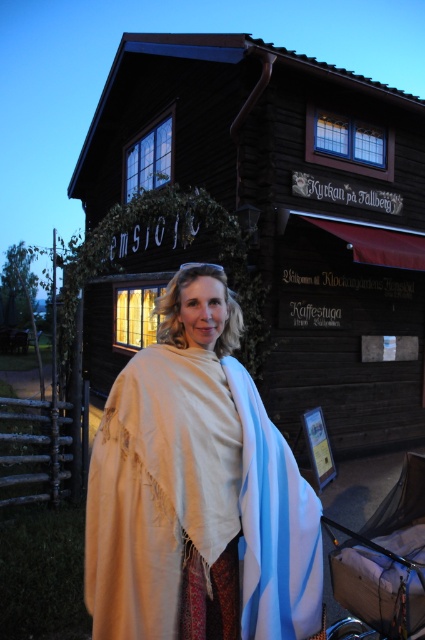
Question: Among these points, which one is farthest from the camera?

Choices:
 (A) (325, 408)
 (B) (379, 528)

Answer: (A)

Question: Considering the relative positions of brown wooden cabin at center and beige wool shawl at center in the image provided, where is brown wooden cabin at center located with respect to beige wool shawl at center?

Choices:
 (A) above
 (B) below

Answer: (A)

Question: Which point is farther to the camera?

Choices:
 (A) (328, 97)
 (B) (260, 513)

Answer: (A)

Question: Can you confirm if brown wooden cabin at center is positioned below beige wool shawl at center?

Choices:
 (A) yes
 (B) no

Answer: (B)

Question: Which object appears closest to the camera in this image?

Choices:
 (A) brown wooden cabin at center
 (B) beige wool shawl at center
 (C) brown fabric baby carriage at lower right

Answer: (B)

Question: Can you confirm if brown wooden cabin at center is wider than beige wool shawl at center?

Choices:
 (A) yes
 (B) no

Answer: (A)